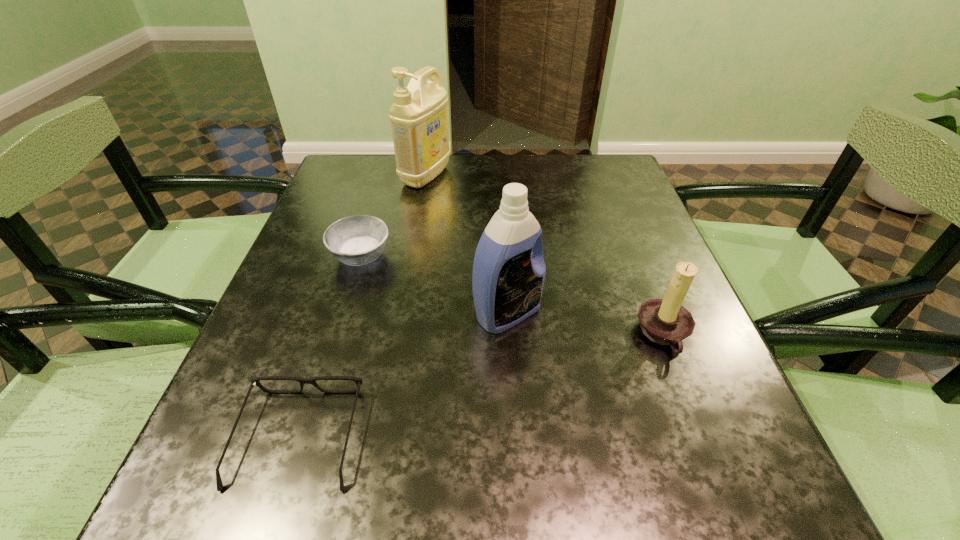
Locate an element on the screen. object that is the fourth nearest to the candle holder is located at coordinates (419, 115).

I want to click on object that is the third nearest to the third tallest object, so click(x=357, y=240).

Where is `vacant space that satisfies the following two spatial constraints: 1. on the front-facing side of the right detergent; 2. on the left side of the nearest object`? This screenshot has height=540, width=960. vacant space that satisfies the following two spatial constraints: 1. on the front-facing side of the right detergent; 2. on the left side of the nearest object is located at coordinates (338, 313).